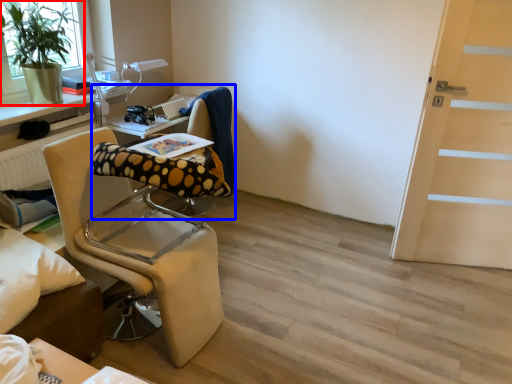
Question: Which object is closer to the camera taking this photo, houseplant (highlighted by a red box) or computer chair (highlighted by a blue box)?

Choices:
 (A) houseplant
 (B) computer chair

Answer: (A)